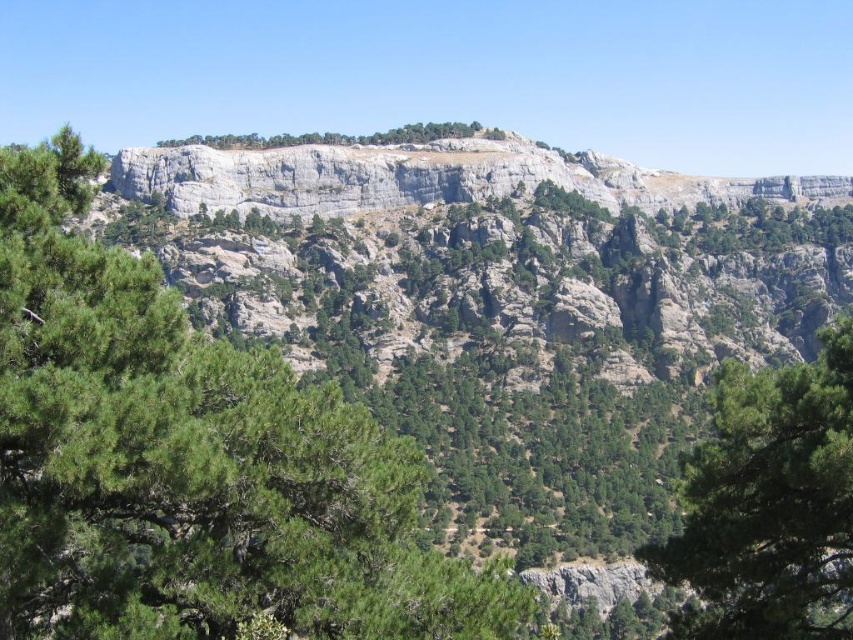
The image size is (853, 640). What do you see at coordinates (190, 461) in the screenshot? I see `green leafy tree at center` at bounding box center [190, 461].

Does green leafy tree at center appear over green leafy trees at center?

No.

Between point (141, 259) and point (251, 134), which one is positioned in front?

Point (141, 259) is more forward.

Where is `green leafy tree at center`? green leafy tree at center is located at coordinates (190, 461).

Is green leafy tree at center to the left of green textured tree at right from the viewer's perspective?

Correct, you'll find green leafy tree at center to the left of green textured tree at right.

Consider the image. Which of these two, green leafy tree at center or green textured tree at right, stands taller?

With more height is green leafy tree at center.

The width and height of the screenshot is (853, 640). Describe the element at coordinates (190, 461) in the screenshot. I see `green leafy tree at center` at that location.

Where is `green leafy tree at center`? green leafy tree at center is located at coordinates tap(190, 461).

Which of these two, green textured tree at right or green leafy trees at center, stands taller?

With more height is green textured tree at right.

Can you confirm if green textured tree at right is taller than green leafy trees at center?

Correct, green textured tree at right is much taller as green leafy trees at center.

Is point (729, 529) positioned in front of point (433, 124)?

Yes, it is in front of point (433, 124).

This screenshot has width=853, height=640. In order to click on green textured tree at right in this screenshot , I will do `click(769, 504)`.